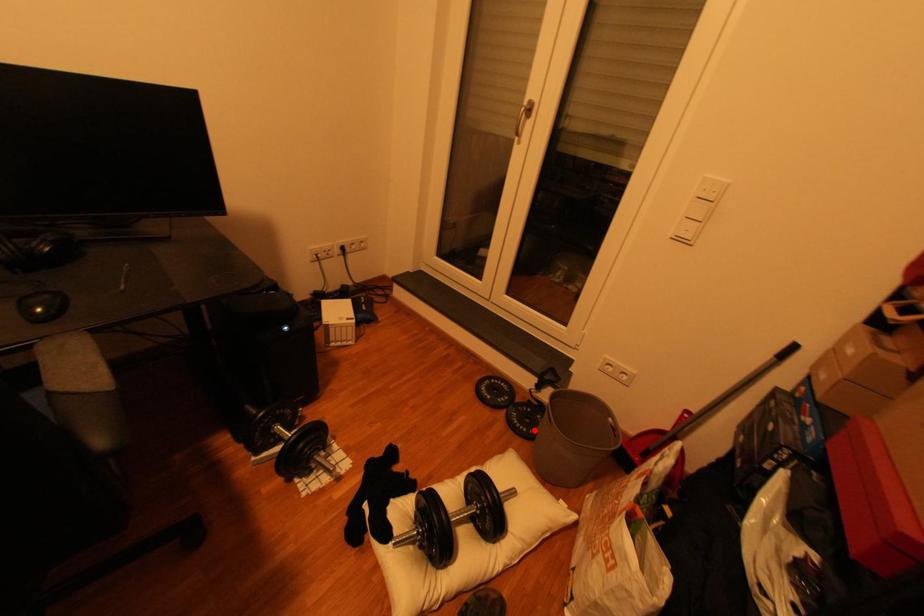
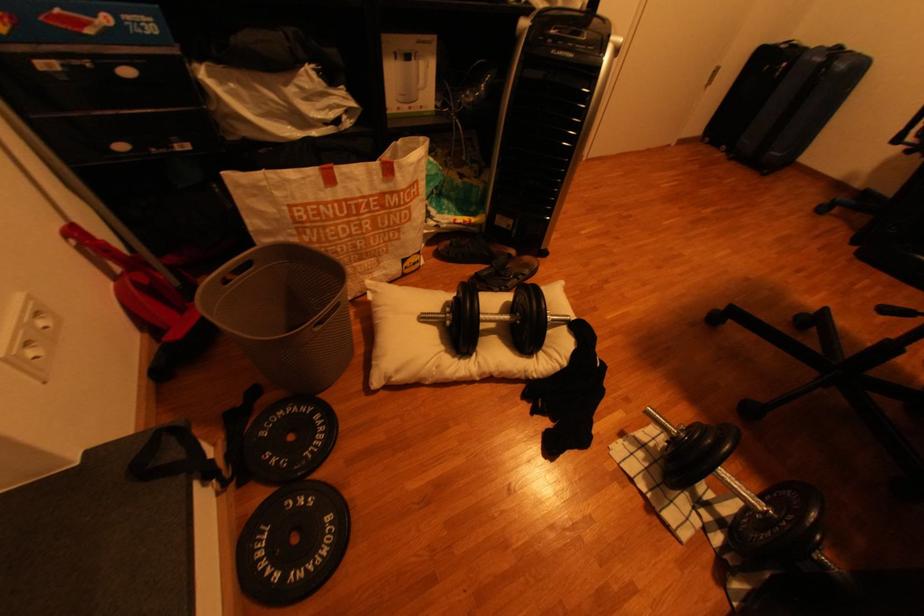
Question: I am providing you with two images of the same scene from different viewpoints. In image1, a red point is highlighted. Considering the same 3D point in image2, which of the following is correct?

Choices:
 (A) It is closer
 (B) It is farther

Answer: (A)